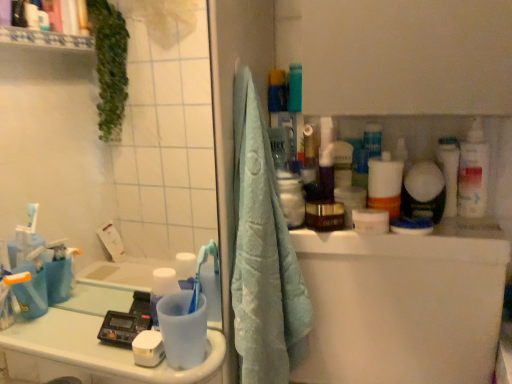
Question: Can you confirm if white glossy toothbrush at upper right is bigger than blue plastic toothbrush at lower left?

Choices:
 (A) yes
 (B) no

Answer: (A)

Question: From the image's perspective, is white glossy toothbrush at upper right on top of blue plastic toothbrush at lower left?

Choices:
 (A) no
 (B) yes

Answer: (B)

Question: From a real-world perspective, does white glossy toothbrush at upper right stand above blue plastic toothbrush at lower left?

Choices:
 (A) no
 (B) yes

Answer: (B)

Question: From the image's perspective, is white glossy toothbrush at upper right below blue plastic toothbrush at lower left?

Choices:
 (A) no
 (B) yes

Answer: (A)

Question: Are white glossy toothbrush at upper right and blue plastic toothbrush at lower left making contact?

Choices:
 (A) no
 (B) yes

Answer: (A)

Question: Are white glossy toothbrush at upper right and blue plastic toothbrush at lower left far apart?

Choices:
 (A) no
 (B) yes

Answer: (A)

Question: Can you see light blue towel at center touching white plastic bottle at right?

Choices:
 (A) yes
 (B) no

Answer: (B)

Question: Are light blue towel at center and white plastic bottle at right located far from each other?

Choices:
 (A) no
 (B) yes

Answer: (A)

Question: Does light blue towel at center appear on the left side of white plastic bottle at right?

Choices:
 (A) yes
 (B) no

Answer: (A)

Question: Is light blue towel at center looking in the opposite direction of white plastic bottle at right?

Choices:
 (A) yes
 (B) no

Answer: (B)

Question: Does light blue towel at center lie behind white plastic bottle at right?

Choices:
 (A) yes
 (B) no

Answer: (B)

Question: From a real-world perspective, is light blue towel at center on white plastic bottle at right?

Choices:
 (A) no
 (B) yes

Answer: (A)

Question: From the image's perspective, does white plastic bottle at right appear lower than light blue towel at center?

Choices:
 (A) no
 (B) yes

Answer: (A)